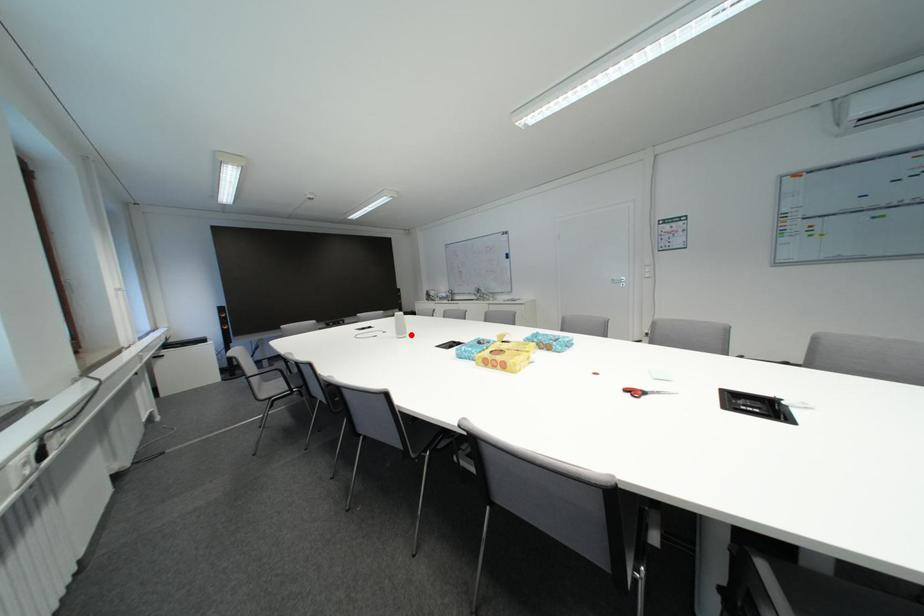
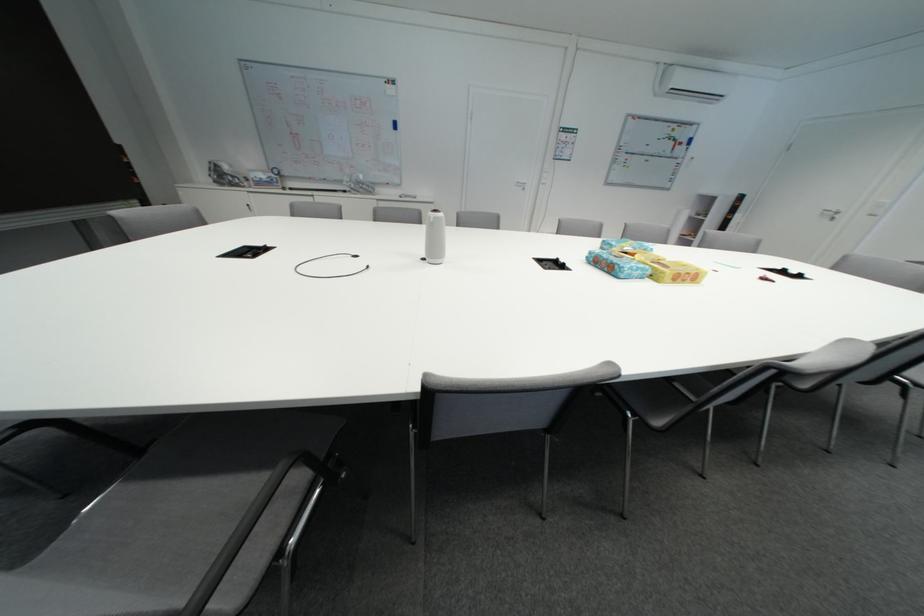
Where in the second image is the point corresponding to the highlighted location from the first image?

(444, 254)